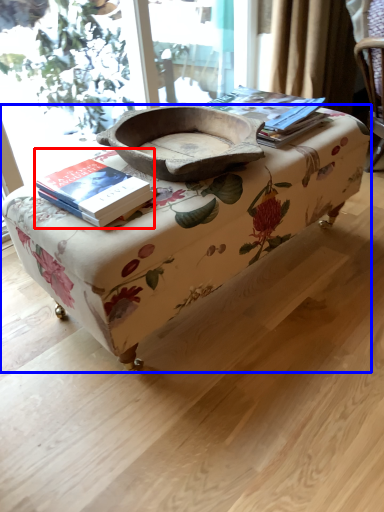
Question: Among these objects, which one is nearest to the camera, book (highlighted by a red box) or table (highlighted by a blue box)?

Choices:
 (A) book
 (B) table

Answer: (B)